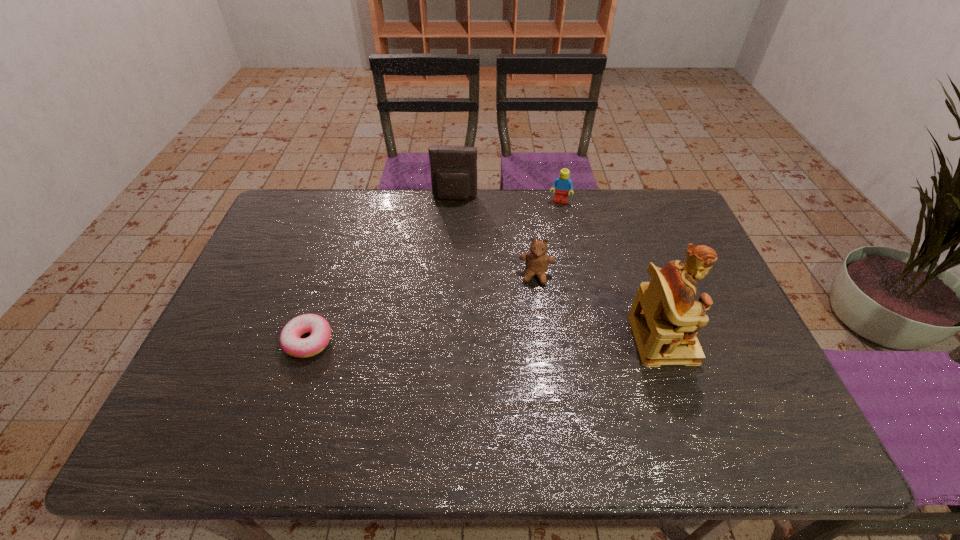
You are a GUI agent. You are given a task and a screenshot of the screen. Output one action in this format:
    pyautogui.click(x=<x>, y=<y>)
    Task: Click on the unoccupied position between the second tallest object and the leftmost object
    The width and height of the screenshot is (960, 540).
    Given the screenshot: What is the action you would take?
    pyautogui.click(x=382, y=269)

Identify the location of vacant area that lies between the third farthest object and the doughnut. (422, 308).

This screenshot has width=960, height=540. What are the coordinates of `vacant space that's between the fourth shortest object and the third object from left to right` in the screenshot? It's located at (495, 237).

Image resolution: width=960 pixels, height=540 pixels. I want to click on free spot between the tallest object and the pouch, so click(559, 268).

Find the location of a particular element. The height and width of the screenshot is (540, 960). vacant area between the fourth object from left to right and the shortest object is located at coordinates (434, 271).

Image resolution: width=960 pixels, height=540 pixels. Identify the location of free point between the shortest object and the fourth object from right to left. click(x=382, y=269).

You are a GUI agent. You are given a task and a screenshot of the screen. Output one action in this format:
    pyautogui.click(x=<x>, y=<y>)
    Task: Click on the vacant area that lies between the rightmost object and the second object from right to left
    
    Given the screenshot: What is the action you would take?
    coord(612,270)

Find the location of `vacant area between the third nearest object and the rightmost object`. vacant area between the third nearest object and the rightmost object is located at coordinates (x=599, y=307).

In order to click on unoccupied position between the third farthest object and the doughnut in this screenshot , I will do `click(422, 308)`.

Locate which object is the third closest to the second object from right to left. Please provide its 2D coordinates. Your answer should be formatted as a tuple, i.e. [(x, y)], where the tuple contains the x and y coordinates of a point satisfying the conditions above.

[(665, 318)]